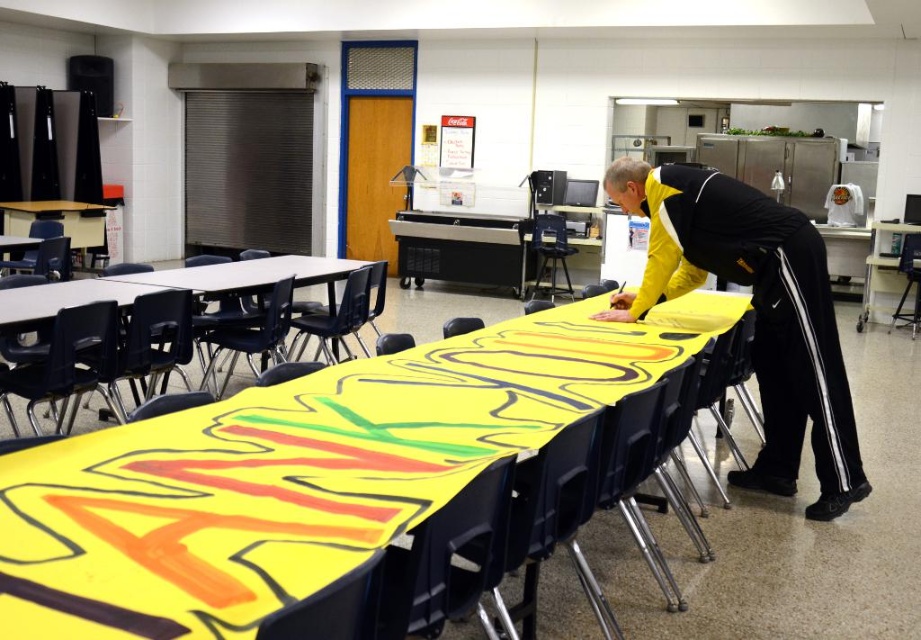
Is yellow paper at center wider than matte plastic table at center?

Yes.

Is yellow paper at center positioned at the back of matte plastic table at center?

No, it is in front of matte plastic table at center.

This screenshot has height=640, width=921. Identify the location of yellow paper at center. (302, 472).

Where is `yellow paper at center`? This screenshot has width=921, height=640. yellow paper at center is located at coordinates (302, 472).

Where is `yellow paper at center`? The image size is (921, 640). yellow paper at center is located at coordinates (302, 472).

Consider the image. Can you confirm if yellow athletic wear at center is thinner than matte plastic table at center?

Yes.

Is yellow athletic wear at center wider than matte plastic table at center?

No, yellow athletic wear at center is not wider than matte plastic table at center.

Is point (745, 220) positioned behind point (246, 292)?

No, (745, 220) is in front of (246, 292).

Identify the location of yellow athletic wear at center. Image resolution: width=921 pixels, height=640 pixels. (755, 314).